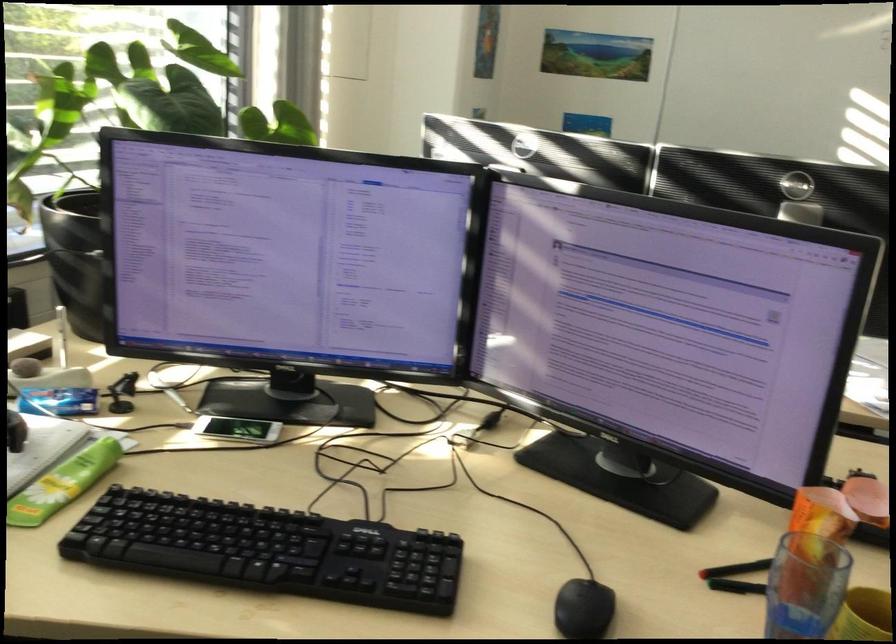
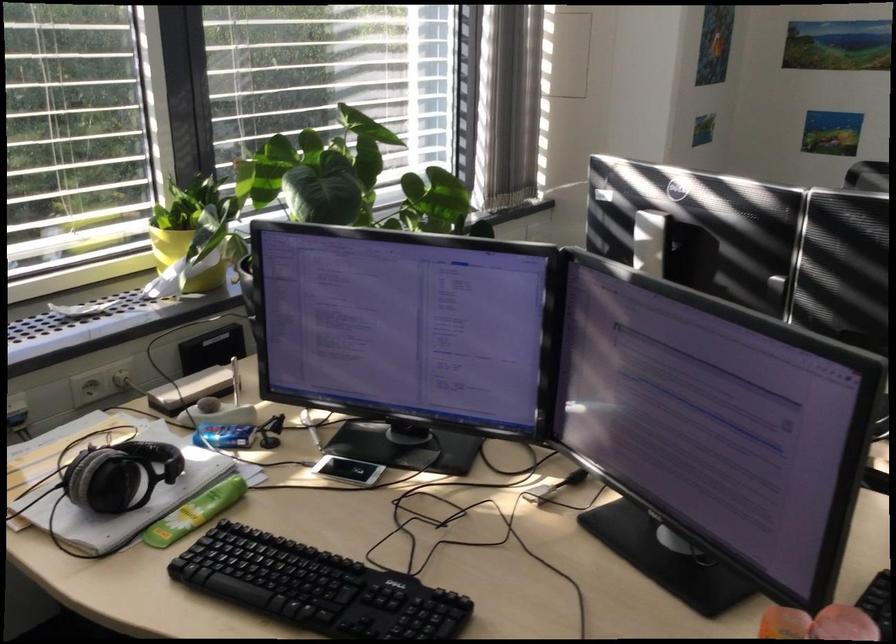
Question: The images are taken continuously from a first-person perspective. In which direction are you moving?

Choices:
 (A) Left
 (B) Right
 (C) Forward
 (D) Backward

Answer: (B)